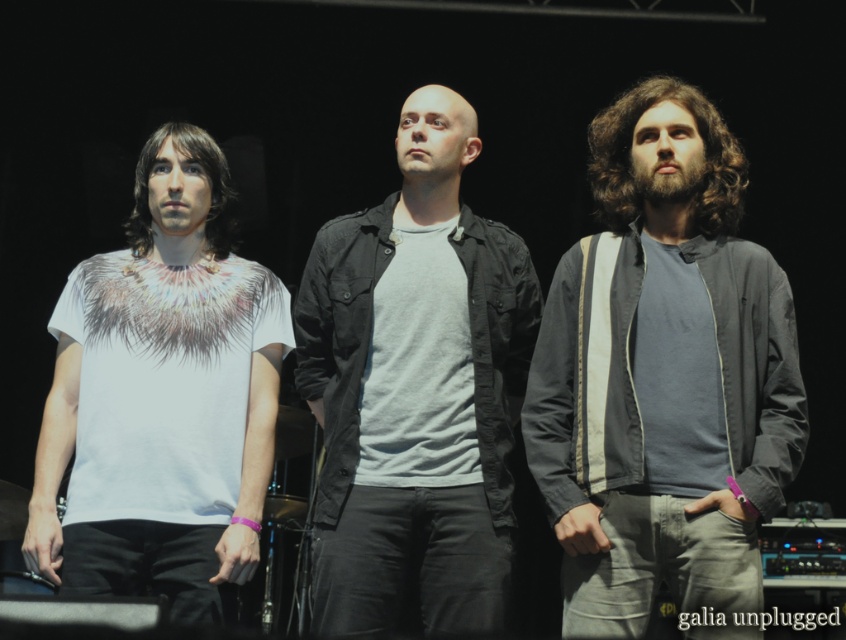
You are a photographer setting up a camera to capture the three individuals on stage. The camera has a limited field of view, and you need to ensure both the gray fabric jacket at right and the matte black jacket at center are fully visible. Based on their sizes, will the camera need to zoom out further to include both jackets without cropping either?

The gray fabric jacket at right might be wider than matte black jacket at center, so the camera may need to zoom out further to ensure both jackets are fully visible without cropping.

You are standing at the origin point in the image. Which of the two points, point (409, 112) or point (191, 552), is farther away from you?

Point (409, 112) is farther away from you because it is behind point (191, 552).